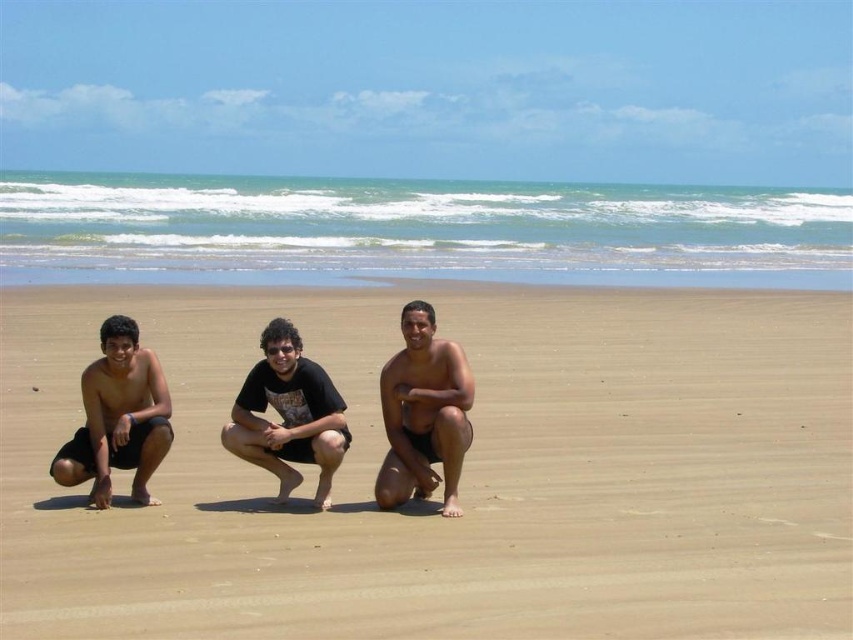
You are standing at the point marked by coordinates [462,474] in the beach scene. Based on the coordinates, what is the location of the brown sandy beach at center?

The point marked by coordinates [462,474] marks the brown sandy beach at center.